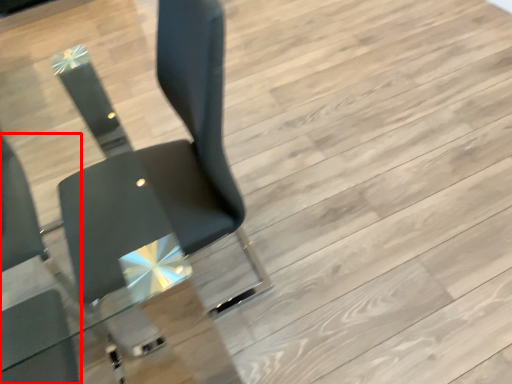
Question: Observing the image, what is the correct spatial positioning of chair (annotated by the red box) in reference to chair?

Choices:
 (A) left
 (B) right

Answer: (A)